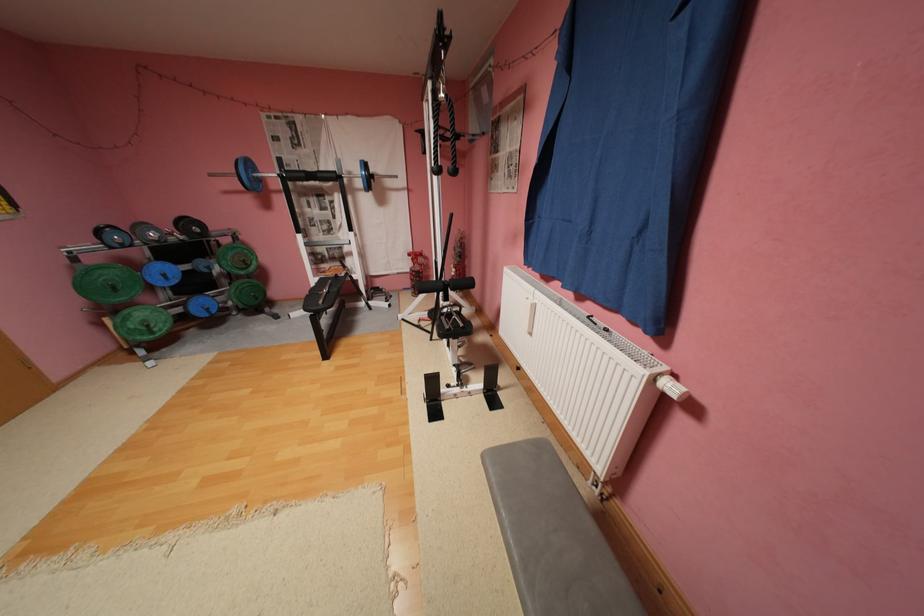
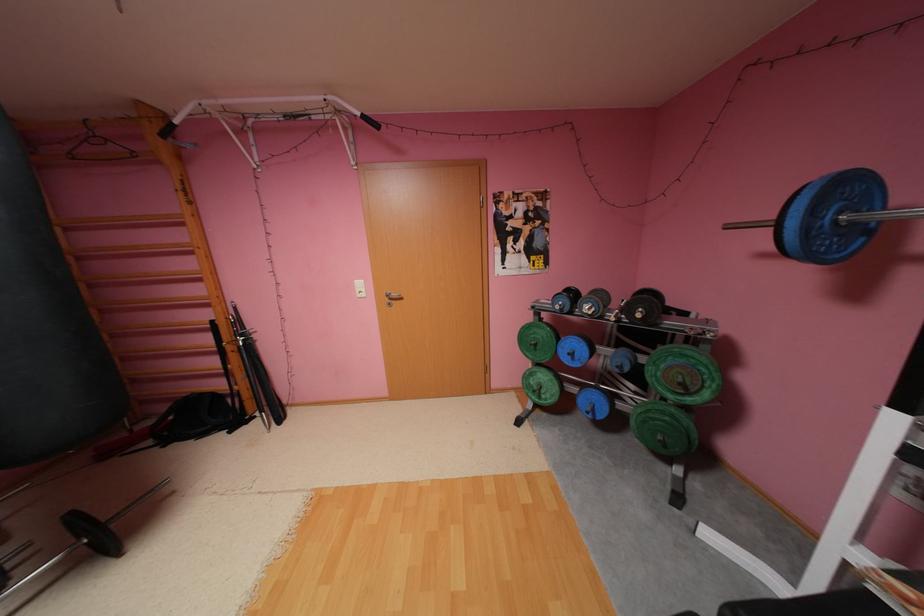
In the second image, find the point that corresponds to (x=258, y=164) in the first image.

(855, 188)